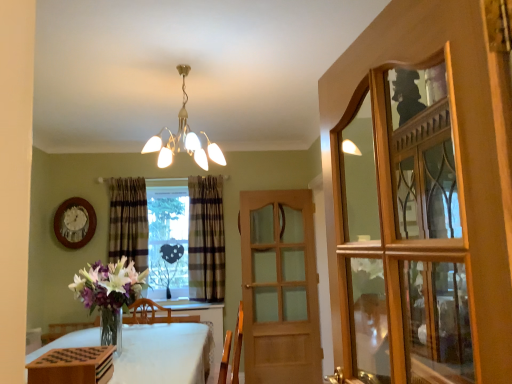
This screenshot has height=384, width=512. Identify the location of vacant area on top of plaid fabric curtain at center, which appears as the 2th curtain when viewed from the right (from a real-world perspective). (129, 182).